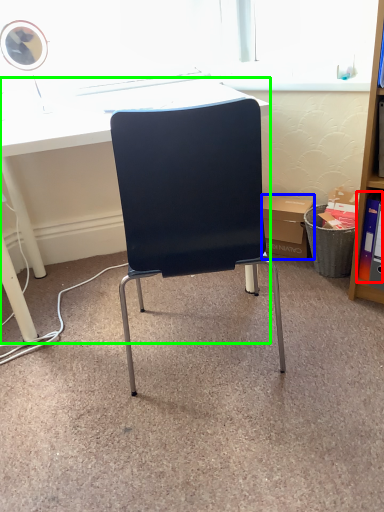
Question: Which object is the farthest from book (highlighted by a red box)? Choose among these: box (highlighted by a blue box) or desk (highlighted by a green box).

Choices:
 (A) box
 (B) desk

Answer: (B)